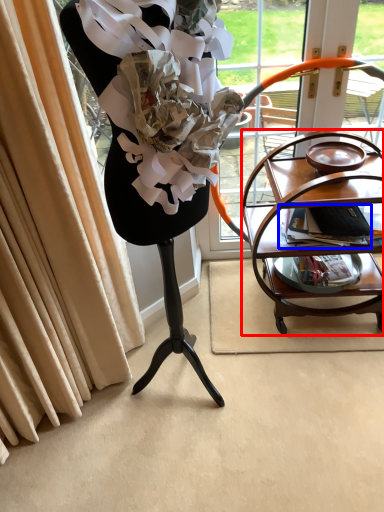
Question: Among these objects, which one is nearest to the camera, table (highlighted by a red box) or magazine (highlighted by a blue box)?

Choices:
 (A) table
 (B) magazine

Answer: (A)